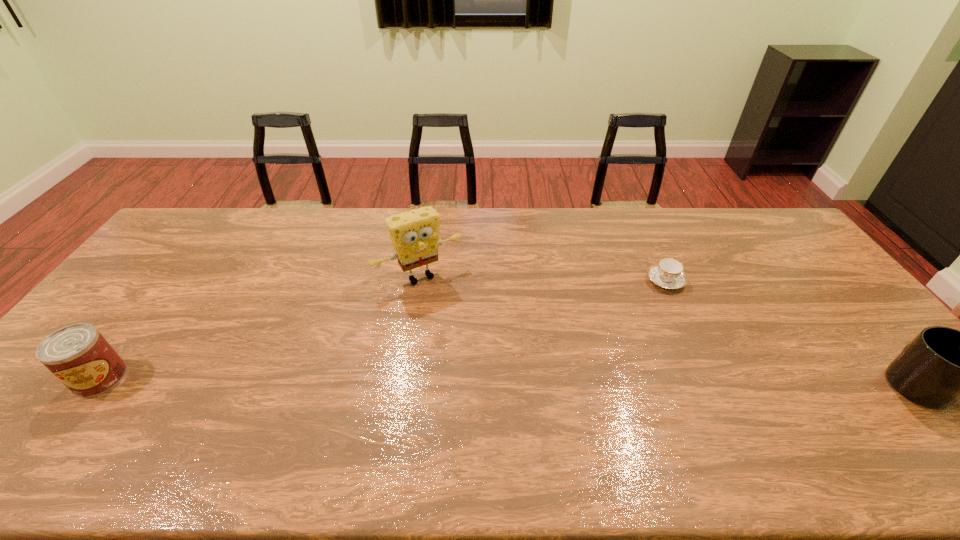
At what (x,y) coordinates should I click in order to perform the action: click on vacant point located on the face of the sponge. Please return your answer as a coordinate pair (x, y). The width and height of the screenshot is (960, 540). Looking at the image, I should click on (x=454, y=314).

Where is `free space located on the face of the sponge`? This screenshot has width=960, height=540. free space located on the face of the sponge is located at coordinates (491, 369).

The image size is (960, 540). What are the coordinates of `object situated at the near edge` in the screenshot? It's located at (78, 355).

In order to click on object that is at the left edge in this screenshot , I will do click(x=78, y=355).

Locate an element on the screen. The width and height of the screenshot is (960, 540). object that is at the near left corner is located at coordinates (78, 355).

The width and height of the screenshot is (960, 540). I want to click on vacant space at the far edge of the desktop, so click(484, 215).

Find the location of a particular element. Image resolution: width=960 pixels, height=540 pixels. vacant area at the near edge of the desktop is located at coordinates (804, 411).

The image size is (960, 540). What are the coordinates of `vacant area at the left edge of the desktop` in the screenshot? It's located at (63, 387).

Identify the location of free space at the far left corner. click(x=190, y=217).

Image resolution: width=960 pixels, height=540 pixels. In the image, there is a desktop. What are the coordinates of `vacant space at the near left corner` in the screenshot? It's located at (12, 422).